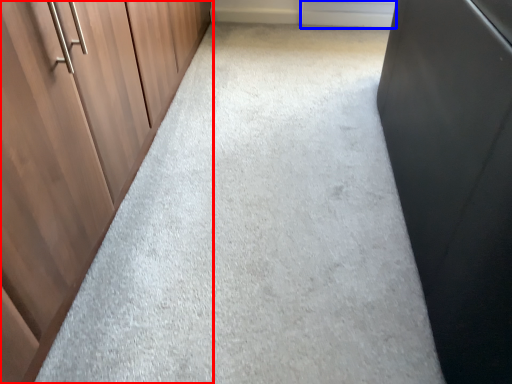
Question: Which object appears closest to the camera in this image, cupboard (highlighted by a red box) or window (highlighted by a blue box)?

Choices:
 (A) cupboard
 (B) window

Answer: (A)